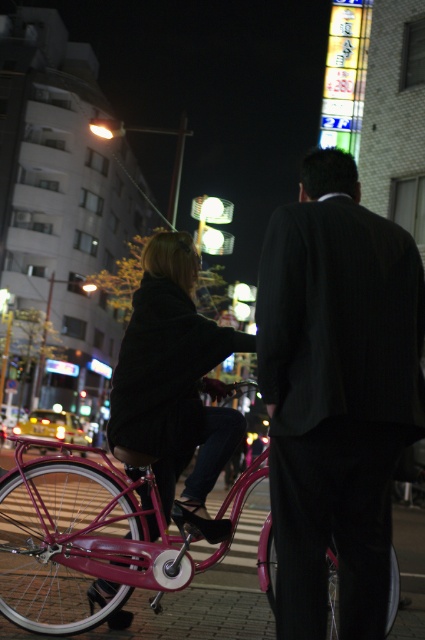
You are standing at the point marked by the coordinate system in the image. There is a dark pinstripe suit at center located at point (x=337, y=392). Can you determine if the dark pinstripe suit at center is directly in front of you or to your side?

The dark pinstripe suit at center is located at point (x=337, y=392), which is directly in front of you since it is at the center of the image.

You are a delivery drone operator. Your drone needs to fly from the pink bicycle in the foreground to the dark pinstripe suit at center. According to the coordinates provided, what is the shortest path your drone can take?

The shortest path for the drone would be a straight line from the pink bicycle in the foreground to the dark pinstripe suit at center, as the coordinates indicate their positions in 2D space.

You are a security guard observing the scene. You notice two people at the center wearing dark pinstripe suit at center and matte black coat at center. Which one is positioned lower in the image?

The dark pinstripe suit at center is positioned lower than the matte black coat at center in the image.